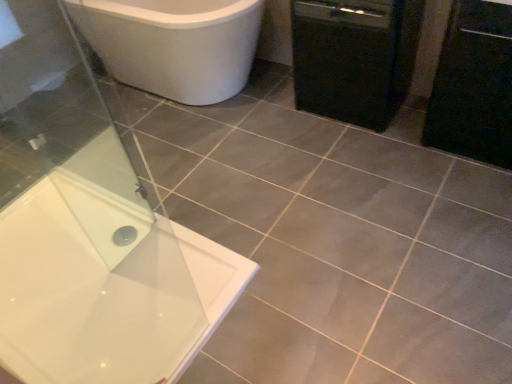
Where is `white glossy bathtub at upper left`? white glossy bathtub at upper left is located at coordinates (89, 229).

Describe the element at coordinates (55, 107) in the screenshot. I see `transparent glass screen door at lower left` at that location.

In order to face black matte dishwasher at right, should I rotate leftwards or rightwards?

To face it directly, rotate right by 12.755 degrees.

Image resolution: width=512 pixels, height=384 pixels. What are the coordinates of `white glossy bathtub at upper left` in the screenshot? It's located at (89, 229).

Considering the points (36, 14) and (302, 19), which point is behind, point (36, 14) or point (302, 19)?

The point (36, 14) is farther.

How distant is white glossy bathtub at upper left from black matte dishwasher at right?

The distance of white glossy bathtub at upper left from black matte dishwasher at right is 1.27 meters.

From the image's perspective, is white glossy bathtub at upper left over black matte dishwasher at right?

No, from the image's perspective, white glossy bathtub at upper left is not on top of black matte dishwasher at right.

This screenshot has width=512, height=384. Find the location of `bathtub in front of the black matte dishwasher at right`. bathtub in front of the black matte dishwasher at right is located at coordinates (89, 229).

From a real-world perspective, which is physically above, white glossy bathtub at upper left or black matte cabinet at right?

white glossy bathtub at upper left.

Would you say white glossy bathtub at upper left is outside black matte cabinet at right?

Absolutely, white glossy bathtub at upper left is external to black matte cabinet at right.

Does white glossy bathtub at upper left lie in front of black matte cabinet at right?

Yes, it is in front of black matte cabinet at right.

From the image's perspective, does white glossy bathtub at upper left appear higher than black matte cabinet at right?

Actually, white glossy bathtub at upper left appears below black matte cabinet at right in the image.

Considering the positions of objects transparent glass screen door at lower left and black matte dishwasher at right in the image provided, who is more to the right, transparent glass screen door at lower left or black matte dishwasher at right?

black matte dishwasher at right is more to the right.

Is transparent glass screen door at lower left positioned with its back to black matte dishwasher at right?

That's right, transparent glass screen door at lower left is facing away from black matte dishwasher at right.

From a real-world perspective, is transparent glass screen door at lower left beneath black matte dishwasher at right?

Actually, transparent glass screen door at lower left is physically above black matte dishwasher at right in the real world.

Is point (85, 64) positioned behind point (390, 85)?

Yes.

Is black matte dishwasher at right outside of transparent glass screen door at lower left?

Indeed, black matte dishwasher at right is completely outside transparent glass screen door at lower left.

Considering the sizes of black matte dishwasher at right and transparent glass screen door at lower left in the image, is black matte dishwasher at right wider or thinner than transparent glass screen door at lower left?

Considering their sizes, black matte dishwasher at right looks broader than transparent glass screen door at lower left.

From the image's perspective, would you say black matte dishwasher at right is positioned over transparent glass screen door at lower left?

Yes.

From the image's perspective, is black matte dishwasher at right positioned above or below black matte cabinet at right?

From the image's perspective, black matte dishwasher at right appears above black matte cabinet at right.

The width and height of the screenshot is (512, 384). I want to click on dish washer below the black matte cabinet at right (from a real-world perspective), so click(354, 57).

Considering the positions of objects black matte dishwasher at right and black matte cabinet at right in the image provided, who is in front, black matte dishwasher at right or black matte cabinet at right?

Positioned in front is black matte cabinet at right.

What are the coordinates of `bathtub below the transparent glass screen door at lower left (from the image's perspective)` in the screenshot? It's located at (89, 229).

Could you tell me if white glossy bathtub at upper left is facing transparent glass screen door at lower left?

No, white glossy bathtub at upper left does not turn towards transparent glass screen door at lower left.

Do you think white glossy bathtub at upper left is within transparent glass screen door at lower left, or outside of it?

white glossy bathtub at upper left is spatially situated outside transparent glass screen door at lower left.

Considering the sizes of objects white glossy bathtub at upper left and transparent glass screen door at lower left in the image provided, who is wider, white glossy bathtub at upper left or transparent glass screen door at lower left?

white glossy bathtub at upper left is wider.

Is black matte cabinet at right far from black matte dishwasher at right?

They are positioned close to each other.

From a real-world perspective, is black matte cabinet at right above or below black matte dishwasher at right?

black matte cabinet at right is above black matte dishwasher at right.

Does black matte cabinet at right have a smaller size compared to black matte dishwasher at right?

Indeed, black matte cabinet at right has a smaller size compared to black matte dishwasher at right.

Is black matte cabinet at right taller or shorter than black matte dishwasher at right?

Considering their sizes, black matte cabinet at right has more height than black matte dishwasher at right.

This screenshot has height=384, width=512. Find the location of `dish washer below the white glossy bathtub at upper left (from a real-world perspective)`. dish washer below the white glossy bathtub at upper left (from a real-world perspective) is located at coordinates (354, 57).

This screenshot has height=384, width=512. Find the location of `bathtub lying on the left of black matte cabinet at right`. bathtub lying on the left of black matte cabinet at right is located at coordinates (89, 229).

Which object lies nearer to the anchor point white glossy bathtub at upper left, black matte dishwasher at right or transparent glass screen door at lower left?

transparent glass screen door at lower left lies closer to white glossy bathtub at upper left than the other object.

Based on their spatial positions, is transparent glass screen door at lower left or white glossy bathtub at upper left closer to black matte cabinet at right?

white glossy bathtub at upper left lies closer to black matte cabinet at right than the other object.

Looking at this image, from the image, which object appears to be farther from white glossy bathtub at upper left, black matte cabinet at right or transparent glass screen door at lower left?

The object further to white glossy bathtub at upper left is black matte cabinet at right.

Which object lies nearer to the anchor point black matte dishwasher at right, black matte cabinet at right or white glossy bathtub at upper left?

black matte cabinet at right is closer to black matte dishwasher at right.

Looking at the image, which one is located closer to black matte dishwasher at right, transparent glass screen door at lower left or white glossy bathtub at upper left?

Based on the image, white glossy bathtub at upper left appears to be nearer to black matte dishwasher at right.

Which object lies nearer to the anchor point transparent glass screen door at lower left, black matte cabinet at right or black matte dishwasher at right?

The object closer to transparent glass screen door at lower left is black matte dishwasher at right.

Considering their positions, is black matte dishwasher at right positioned closer to black matte cabinet at right than transparent glass screen door at lower left?

black matte dishwasher at right is closer to black matte cabinet at right.

Looking at the image, which one is located closer to white glossy bathtub at upper left, black matte dishwasher at right or black matte cabinet at right?

The object closer to white glossy bathtub at upper left is black matte dishwasher at right.

At what (x,y) coordinates should I click in order to perform the action: click on bathtub between transparent glass screen door at lower left and black matte cabinet at right. Please return your answer as a coordinate pair (x, y). Image resolution: width=512 pixels, height=384 pixels. Looking at the image, I should click on (89, 229).

At what (x,y) coordinates should I click in order to perform the action: click on dish washer between white glossy bathtub at upper left and black matte cabinet at right from left to right. Please return your answer as a coordinate pair (x, y). The width and height of the screenshot is (512, 384). Looking at the image, I should click on (354, 57).

This screenshot has width=512, height=384. What are the coordinates of `bathtub situated between transparent glass screen door at lower left and black matte dishwasher at right from left to right` in the screenshot? It's located at [89, 229].

The width and height of the screenshot is (512, 384). In order to click on dish washer between transparent glass screen door at lower left and black matte cabinet at right in the horizontal direction in this screenshot , I will do `click(354, 57)`.